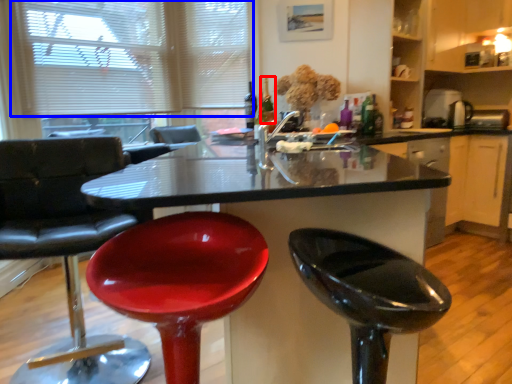
Question: Among these objects, which one is farthest to the camera, wine bottle (highlighted by a red box) or blind (highlighted by a blue box)?

Choices:
 (A) wine bottle
 (B) blind

Answer: (A)